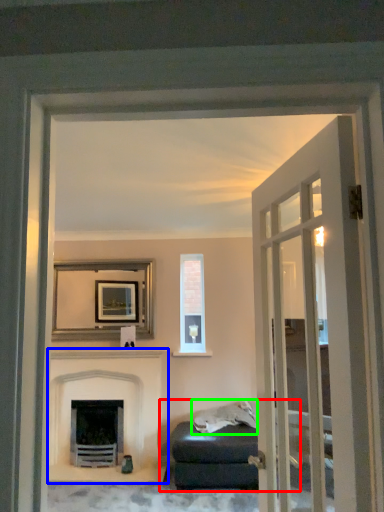
Question: Which object is positioned closest to studio couch (highlighted by a red box)? Select from fireplace (highlighted by a blue box) and material (highlighted by a green box).

Choices:
 (A) fireplace
 (B) material

Answer: (B)